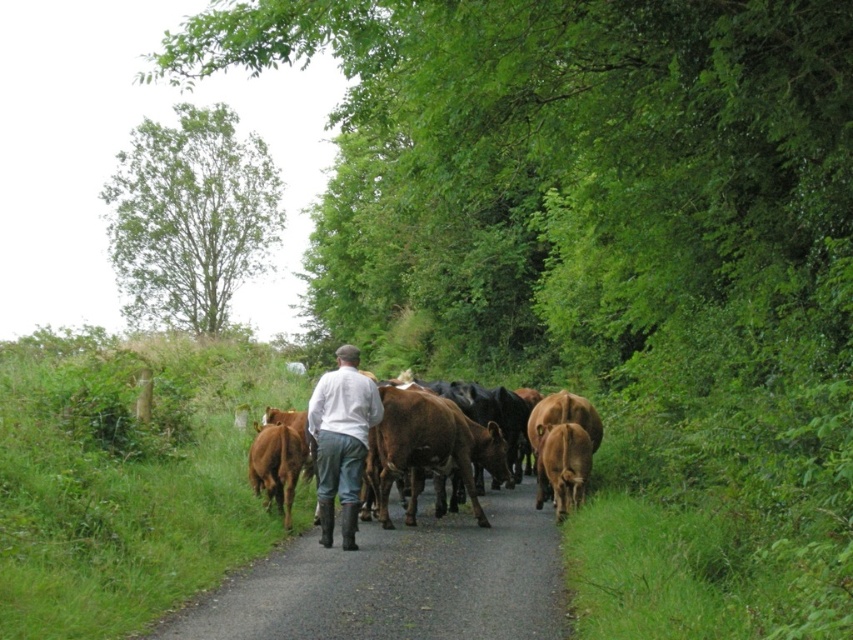
You are standing at the point marked with coordinates (389, 442) in this rural scene. What object are you standing on?

You are standing on the brown glossy cows at center.

Looking at this image, you are a photographer planning to capture the scene with the green leafy tree at upper left and the brown glossy cow at center. Which object is wider in the image?

The green leafy tree at upper left is wider than the brown glossy cow at center.

You are standing on the road and see two points marked on the ground ahead of you. The first point is at position point (329, 536) and the second point is at position point (556, 509). Which point is closer to you?

Point (329, 536) is closer to the viewer than point (556, 509).